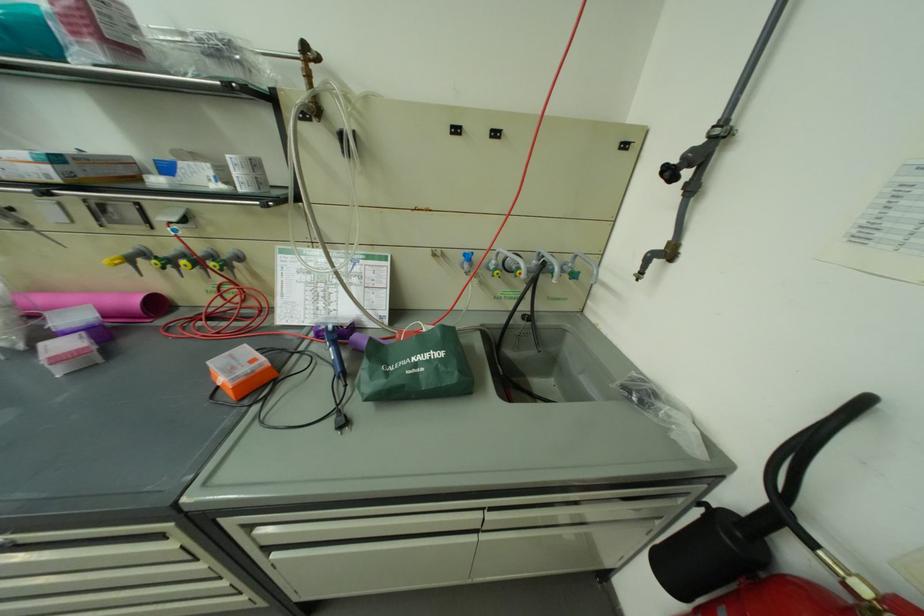
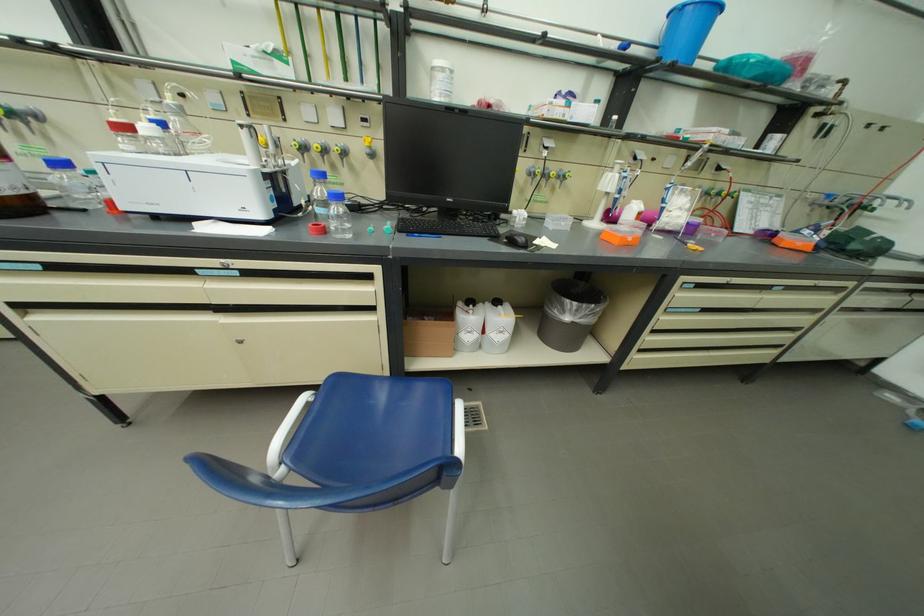
Question: In a continuous first-person perspective shot, in which direction is the camera moving?

Choices:
 (A) Left
 (B) Right
 (C) Forward
 (D) Backward

Answer: (A)